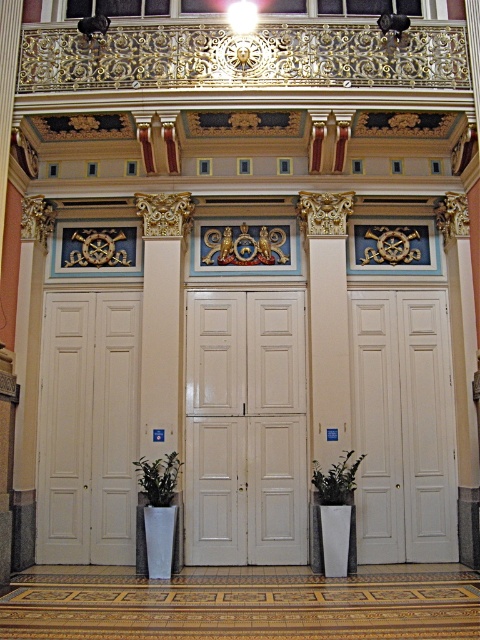
You are standing in the grand hall and want to take a photo of the two points marked in the scene. Which point, point (235, 480) or point (399, 417), appears larger in your camera view?

Point (235, 480) appears larger in the camera view because it is closer to the camera than point (399, 417).

You are standing in the grand hall and want to reach a specific point marked at coordinates point (359,314). If your maximum comfortable walking distance is 10 meters, will you be able to comfortably reach that point?

The distance between you and point (359,314) is 11.53 meters, which exceeds your maximum comfortable walking distance of 10 meters. Therefore, you will not be able to comfortably reach that point.

You are a visitor entering the grand hall and see the white matte door at center and the green matte plant at center. Which object is closer to you as you face the entrance?

The white matte door at center is closer to you because the green matte plant at center is positioned behind it.